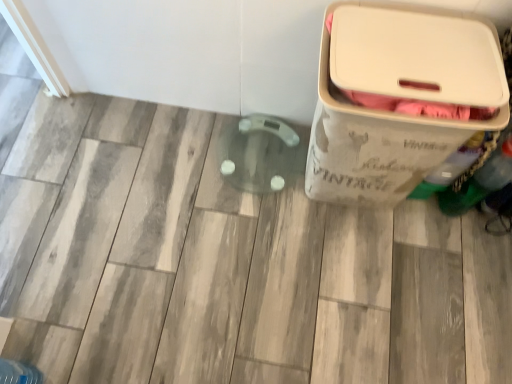
Question: Considering the relative sizes of translucent plastic bottle at upper right and beige plastic container at right in the image provided, is translucent plastic bottle at upper right smaller than beige plastic container at right?

Choices:
 (A) yes
 (B) no

Answer: (A)

Question: Is translucent plastic bottle at upper right further to camera compared to beige plastic container at right?

Choices:
 (A) yes
 (B) no

Answer: (A)

Question: Is translucent plastic bottle at upper right facing away from beige plastic container at right?

Choices:
 (A) yes
 (B) no

Answer: (B)

Question: From a real-world perspective, is translucent plastic bottle at upper right under beige plastic container at right?

Choices:
 (A) yes
 (B) no

Answer: (A)

Question: Is beige plastic container at right a part of translucent plastic bottle at upper right?

Choices:
 (A) no
 (B) yes

Answer: (A)

Question: From the image's perspective, is translucent plastic bottle at upper right located above beige plastic container at right?

Choices:
 (A) no
 (B) yes

Answer: (A)

Question: Can you confirm if beige plastic container at right is bigger than translucent plastic bottle at upper right?

Choices:
 (A) yes
 (B) no

Answer: (A)

Question: Does beige plastic container at right have a lesser height compared to translucent plastic bottle at upper right?

Choices:
 (A) yes
 (B) no

Answer: (B)

Question: Is beige plastic container at right further to camera compared to translucent plastic bottle at upper right?

Choices:
 (A) yes
 (B) no

Answer: (B)

Question: Does beige plastic container at right have a greater height compared to translucent plastic bottle at upper right?

Choices:
 (A) yes
 (B) no

Answer: (A)

Question: Considering the relative positions of beige plastic container at right and translucent plastic bottle at upper right in the image provided, is beige plastic container at right to the left of translucent plastic bottle at upper right from the viewer's perspective?

Choices:
 (A) yes
 (B) no

Answer: (A)

Question: Is beige plastic container at right smaller than translucent plastic bottle at upper right?

Choices:
 (A) no
 (B) yes

Answer: (A)

Question: Is translucent plastic bottle at upper right wider or thinner than beige plastic container at right?

Choices:
 (A) thin
 (B) wide

Answer: (A)